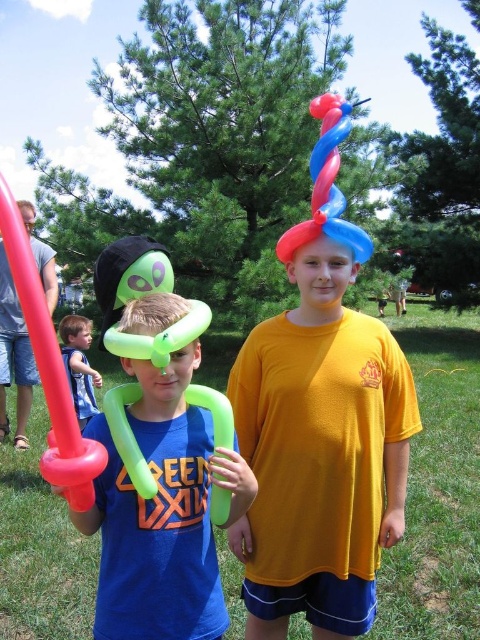
The width and height of the screenshot is (480, 640). Describe the element at coordinates (320, 451) in the screenshot. I see `matte yellow t-shirt at center` at that location.

Looking at this image, is matte yellow t-shirt at center above blue rubber balloon at center?

Incorrect, matte yellow t-shirt at center is not positioned above blue rubber balloon at center.

Is point (339, 396) more distant than point (346, 113)?

No, it is not.

Identify the location of matte yellow t-shirt at center. This screenshot has height=640, width=480. (320, 451).

Is matte yellow t-shirt at center taller than shiny blue balloon hat at center?

Yes, matte yellow t-shirt at center is taller than shiny blue balloon hat at center.

Does matte yellow t-shirt at center appear on the right side of shiny blue balloon hat at center?

In fact, matte yellow t-shirt at center is to the left of shiny blue balloon hat at center.

Locate an element on the screen. The image size is (480, 640). matte yellow t-shirt at center is located at coordinates pyautogui.click(x=320, y=451).

At what (x,y) coordinates should I click in order to perform the action: click on green matte balloon sword at left. Please return your answer as a coordinate pair (x, y). Looking at the image, I should click on (163, 515).

Measure the distance between point (152, 518) and camera.

Point (152, 518) and camera are 1.58 meters apart.

In order to click on green matte balloon sword at left in this screenshot , I will do `click(163, 515)`.